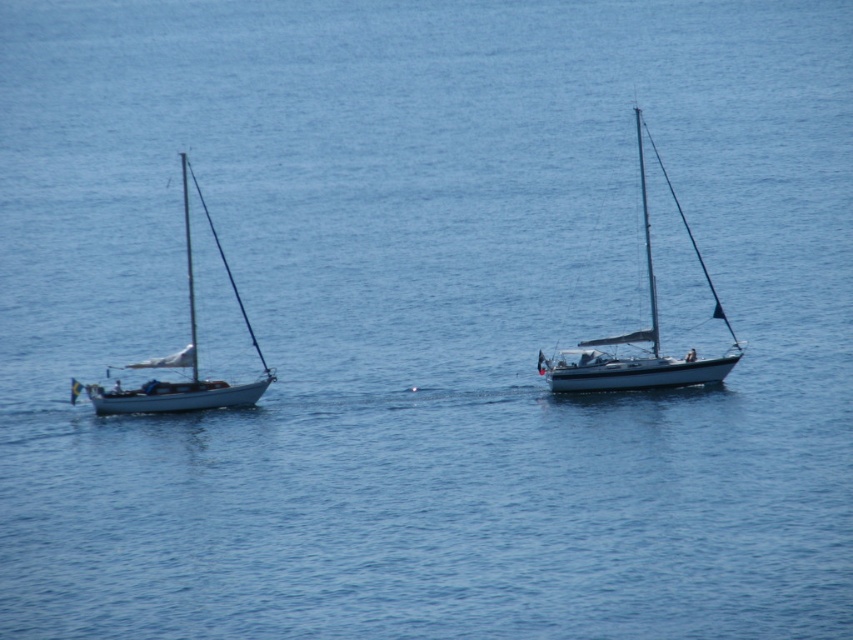
You are a sailor standing on the deck of the white glossy sailboat at center and want to reach the white matte mast at upper center to adjust the flag. Can you do it without moving from your current position?

The distance between the white glossy sailboat at center and the white matte mast at upper center is 4.51 feet. Since you are already on the deck of the white glossy sailboat at center, you can reach the white matte mast at upper center to adjust the flag without moving from your current position if the mast is within your arm reach. However, the question does not provide information about your arm length or the exact position of the mast relative to the deck. Therefore, it is unclear if you can reach it.

You are a sailor on the white glossy sailboat at center and want to know if you can see the white matte mast at upper center from your current position. Based on their positions, can you see it?

The white glossy sailboat at center is in front of the white matte mast at upper center, so the mast is behind the sailboat. Therefore, you cannot see the white matte mast at upper center from your current position on the white glossy sailboat at center.

You are a sailor planning to dock your boat next to the white glossy sailboat at center and the white matte mast at upper center. Considering their sizes, which object will require more space along the dock?

The white glossy sailboat at center requires more space along the dock since its width surpasses that of the white matte mast at upper center.